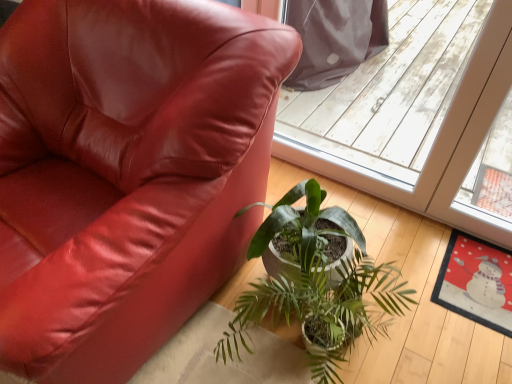
Identify the location of free space underneath green glossy plant at center (from a real-world perspective). This screenshot has height=384, width=512. (294, 361).